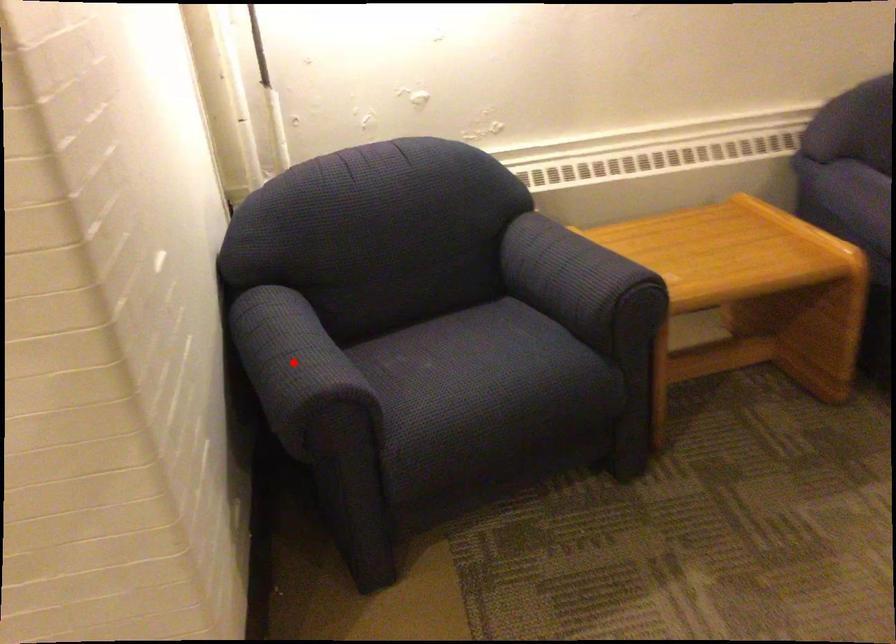
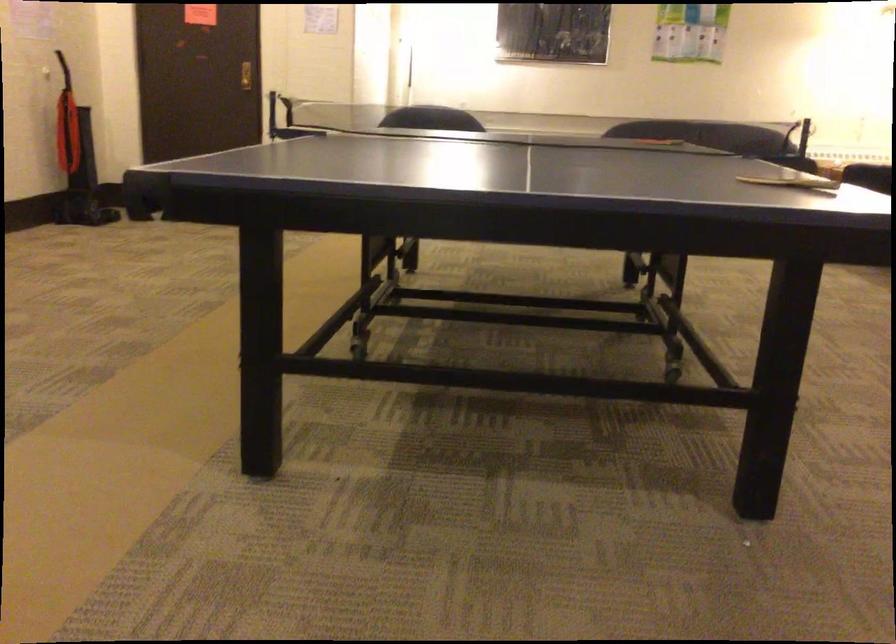
Question: I am providing you with two images of the same scene from different viewpoints. A red point is marked on the first image. Is the red point's position out of view in image 2?

Choices:
 (A) Yes
 (B) No

Answer: (A)